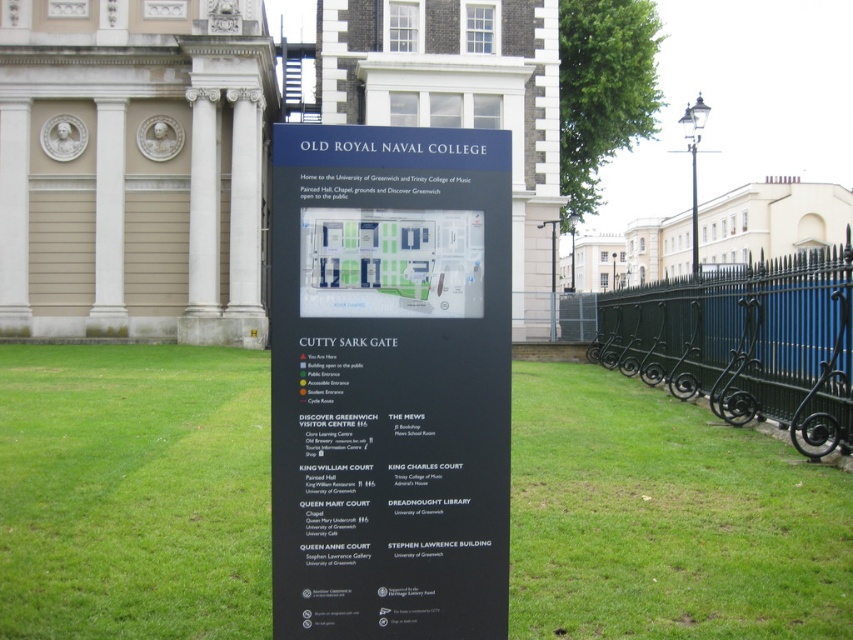
You are a tourist holding a camera that is 12 inches tall. You want to take a photo of the black matte sign at center and the green wrought iron fence at right. Can your camera fit both objects in the frame vertically if the camera can only capture up to 14 inches in height?

The black matte sign at center is shorter than the green wrought iron fence at right. Since the camera can only capture up to 14 inches in height, and the tallest object is the green wrought iron fence at right, which is taller than the sign, but the exact height isn

You are standing in front of the Old Royal Naval College in Greenwich, London. You see the green grass at center and the black matte sign at center. Which object takes up more space in the image?

The green grass at center has a larger size compared to the black matte sign at center, so it takes up more space in the image.

Based on the photo, you are a tourist standing in front of the signboard at the Old Royal Naval College. You see the green grass at center and the green wrought iron fence at right. Which object is closer to you?

The green grass at center is closer to you because it is in front of the green wrought iron fence at right.